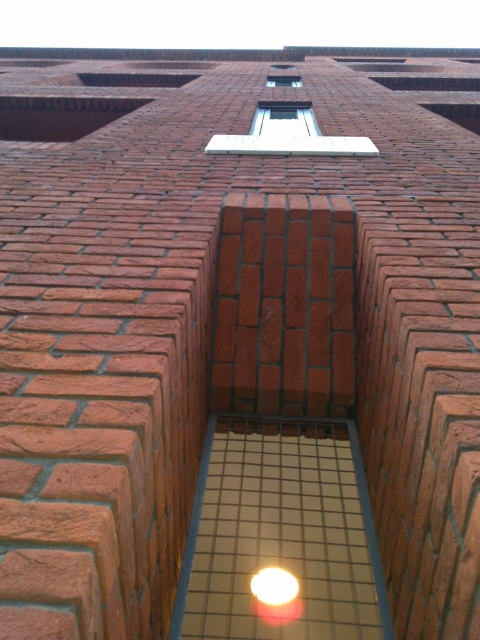
Is clear glass window at center taller than clear glass window at upper center?

Yes.

Which is more to the left, clear glass window at center or clear glass window at upper center?

Positioned to the left is clear glass window at center.

Locate an element on the screen. This screenshot has width=480, height=640. clear glass window at center is located at coordinates (284, 120).

Image resolution: width=480 pixels, height=640 pixels. I want to click on clear glass window at center, so click(284, 120).